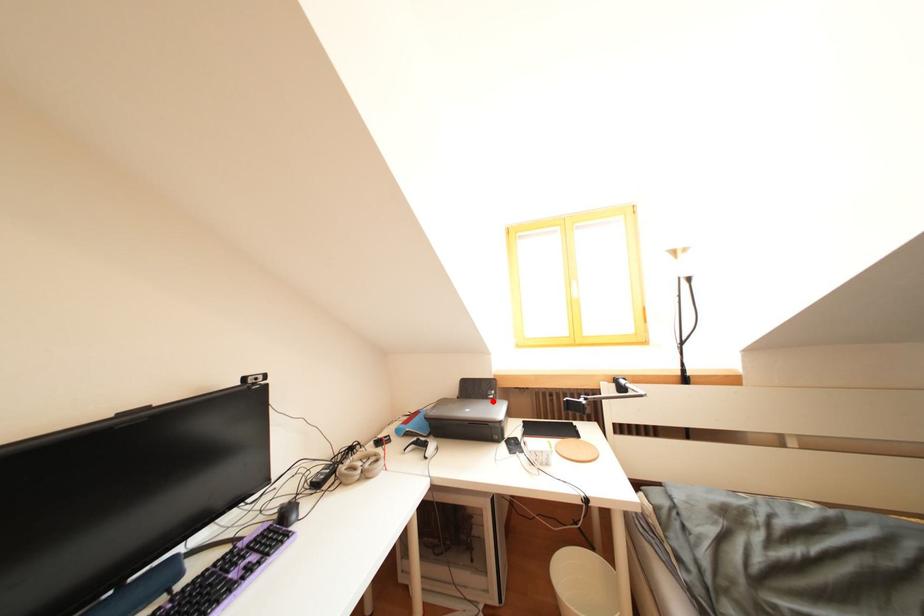
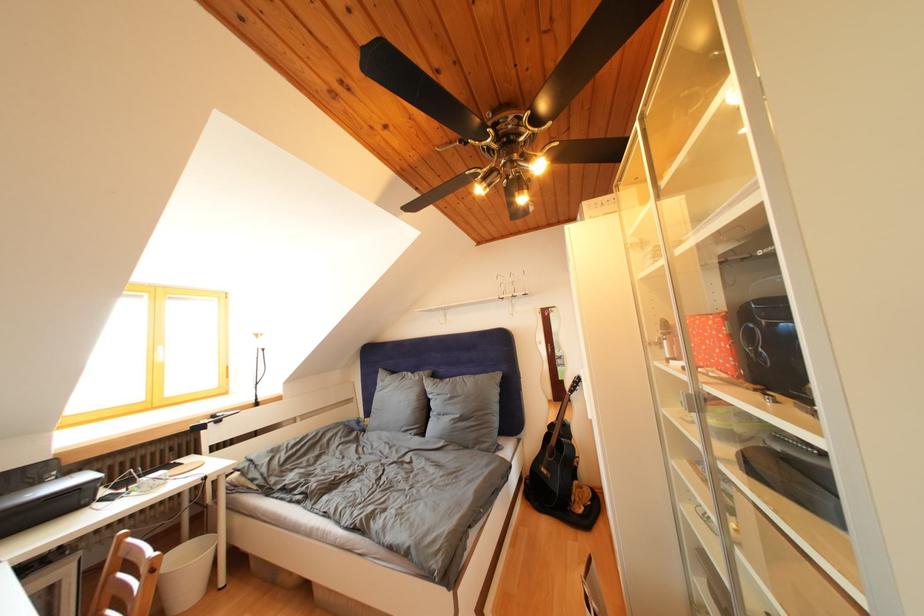
Where in the second image is the point corresponding to the highlighted location from the first image?

(44, 488)